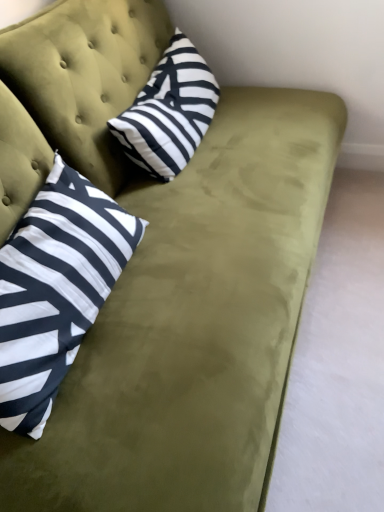
The height and width of the screenshot is (512, 384). What do you see at coordinates (169, 112) in the screenshot? I see `black and white striped pillow at upper center, the first pillow in the top-to-bottom sequence` at bounding box center [169, 112].

Locate an element on the screen. black and white striped pillow at upper center, the first pillow in the top-to-bottom sequence is located at coordinates (169, 112).

This screenshot has height=512, width=384. Identify the location of white and black striped pillow at left, which ranks as the first pillow in bottom-to-top order. (55, 289).

Describe the element at coordinates (55, 289) in the screenshot. I see `white and black striped pillow at left, which ranks as the first pillow in bottom-to-top order` at that location.

Where is `black and white striped pillow at upper center, the first pillow in the top-to-bottom sequence`? This screenshot has width=384, height=512. black and white striped pillow at upper center, the first pillow in the top-to-bottom sequence is located at coordinates (169, 112).

Considering the relative positions of white and black striped pillow at left, the 2th pillow positioned from the top, and black and white striped pillow at upper center, the second pillow in the bottom-to-top sequence, in the image provided, is white and black striped pillow at left, the 2th pillow positioned from the top, to the right of black and white striped pillow at upper center, the second pillow in the bottom-to-top sequence, from the viewer's perspective?

No.

In the image, is white and black striped pillow at left, the 2th pillow positioned from the top, positioned in front of or behind black and white striped pillow at upper center, the second pillow in the bottom-to-top sequence?

white and black striped pillow at left, the 2th pillow positioned from the top, is in front of black and white striped pillow at upper center, the second pillow in the bottom-to-top sequence.

Which is in front, point (20, 314) or point (172, 69)?

Point (20, 314)

From the image's perspective, is white and black striped pillow at left, the 2th pillow positioned from the top, on top of black and white striped pillow at upper center, the first pillow in the top-to-bottom sequence?

No, from the image's perspective, white and black striped pillow at left, the 2th pillow positioned from the top, is not over black and white striped pillow at upper center, the first pillow in the top-to-bottom sequence.

Based on the photo, from a real-world perspective, is white and black striped pillow at left, which ranks as the first pillow in bottom-to-top order, positioned above or below black and white striped pillow at upper center, the first pillow in the top-to-bottom sequence?

Clearly, from a real-world perspective, white and black striped pillow at left, which ranks as the first pillow in bottom-to-top order, is above black and white striped pillow at upper center, the first pillow in the top-to-bottom sequence.

Is white and black striped pillow at left, the 2th pillow positioned from the top, thinner than black and white striped pillow at upper center, the second pillow in the bottom-to-top sequence?

No.

Does white and black striped pillow at left, the 2th pillow positioned from the top, have a lesser height compared to black and white striped pillow at upper center, the first pillow in the top-to-bottom sequence?

No.

Considering the sizes of objects white and black striped pillow at left, the 2th pillow positioned from the top, and black and white striped pillow at upper center, the first pillow in the top-to-bottom sequence, in the image provided, who is smaller, white and black striped pillow at left, the 2th pillow positioned from the top, or black and white striped pillow at upper center, the first pillow in the top-to-bottom sequence,?

Smaller between the two is black and white striped pillow at upper center, the first pillow in the top-to-bottom sequence.

Can black and white striped pillow at upper center, the first pillow in the top-to-bottom sequence, be found inside white and black striped pillow at left, which ranks as the first pillow in bottom-to-top order?

No, black and white striped pillow at upper center, the first pillow in the top-to-bottom sequence, is not surrounded by white and black striped pillow at left, which ranks as the first pillow in bottom-to-top order.

Would you say white and black striped pillow at left, the 2th pillow positioned from the top, is a long distance from black and white striped pillow at upper center, the first pillow in the top-to-bottom sequence?

No, white and black striped pillow at left, the 2th pillow positioned from the top, is in close proximity to black and white striped pillow at upper center, the first pillow in the top-to-bottom sequence.

Is white and black striped pillow at left, which ranks as the first pillow in bottom-to-top order, turned away from black and white striped pillow at upper center, the first pillow in the top-to-bottom sequence?

white and black striped pillow at left, which ranks as the first pillow in bottom-to-top order, does not have its back to black and white striped pillow at upper center, the first pillow in the top-to-bottom sequence.

How many degrees apart are the facing directions of white and black striped pillow at left, which ranks as the first pillow in bottom-to-top order, and black and white striped pillow at upper center, the first pillow in the top-to-bottom sequence?

There is a 3.83-degree angle between the facing directions of white and black striped pillow at left, which ranks as the first pillow in bottom-to-top order, and black and white striped pillow at upper center, the first pillow in the top-to-bottom sequence.

At what (x,y) coordinates should I click in order to perform the action: click on pillow above the white and black striped pillow at left, the 2th pillow positioned from the top (from the image's perspective). Please return your answer as a coordinate pair (x, y). Looking at the image, I should click on (169, 112).

From the picture: Which is more to the right, black and white striped pillow at upper center, the first pillow in the top-to-bottom sequence, or white and black striped pillow at left, the 2th pillow positioned from the top?

Positioned to the right is black and white striped pillow at upper center, the first pillow in the top-to-bottom sequence.

Considering the positions of objects black and white striped pillow at upper center, the first pillow in the top-to-bottom sequence, and white and black striped pillow at left, the 2th pillow positioned from the top, in the image provided, who is in front, black and white striped pillow at upper center, the first pillow in the top-to-bottom sequence, or white and black striped pillow at left, the 2th pillow positioned from the top,?

white and black striped pillow at left, the 2th pillow positioned from the top, is more forward.

Which is nearer, (148, 165) or (22, 220)?

Point (148, 165) appears to be farther away from the viewer than point (22, 220).

From the image's perspective, which object appears higher, black and white striped pillow at upper center, the second pillow in the bottom-to-top sequence, or white and black striped pillow at left, the 2th pillow positioned from the top?

black and white striped pillow at upper center, the second pillow in the bottom-to-top sequence, from the image's perspective.

From a real-world perspective, who is located lower, black and white striped pillow at upper center, the first pillow in the top-to-bottom sequence, or white and black striped pillow at left, which ranks as the first pillow in bottom-to-top order?

In real-world perspective, black and white striped pillow at upper center, the first pillow in the top-to-bottom sequence, is lower.

Is black and white striped pillow at upper center, the first pillow in the top-to-bottom sequence, wider or thinner than white and black striped pillow at left, the 2th pillow positioned from the top?

Clearly, black and white striped pillow at upper center, the first pillow in the top-to-bottom sequence, has less width compared to white and black striped pillow at left, the 2th pillow positioned from the top.

Is black and white striped pillow at upper center, the first pillow in the top-to-bottom sequence, taller or shorter than white and black striped pillow at left, which ranks as the first pillow in bottom-to-top order?

Considering their sizes, black and white striped pillow at upper center, the first pillow in the top-to-bottom sequence, has less height than white and black striped pillow at left, which ranks as the first pillow in bottom-to-top order.

Does black and white striped pillow at upper center, the second pillow in the bottom-to-top sequence, have a smaller size compared to white and black striped pillow at left, the 2th pillow positioned from the top?

Indeed, black and white striped pillow at upper center, the second pillow in the bottom-to-top sequence, has a smaller size compared to white and black striped pillow at left, the 2th pillow positioned from the top.

Is black and white striped pillow at upper center, the first pillow in the top-to-bottom sequence, not inside white and black striped pillow at left, the 2th pillow positioned from the top?

Yes, black and white striped pillow at upper center, the first pillow in the top-to-bottom sequence, is not within white and black striped pillow at left, the 2th pillow positioned from the top.

Is black and white striped pillow at upper center, the second pillow in the bottom-to-top sequence, with white and black striped pillow at left, the 2th pillow positioned from the top?

No, black and white striped pillow at upper center, the second pillow in the bottom-to-top sequence, is not in contact with white and black striped pillow at left, the 2th pillow positioned from the top.

Is black and white striped pillow at upper center, the second pillow in the bottom-to-top sequence, facing away from white and black striped pillow at left, the 2th pillow positioned from the top?

No.

How many degrees apart are the facing directions of black and white striped pillow at upper center, the second pillow in the bottom-to-top sequence, and white and black striped pillow at left, the 2th pillow positioned from the top?

There is a 3.83-degree angle between the facing directions of black and white striped pillow at upper center, the second pillow in the bottom-to-top sequence, and white and black striped pillow at left, the 2th pillow positioned from the top.

How much distance is there between black and white striped pillow at upper center, the second pillow in the bottom-to-top sequence, and white and black striped pillow at left, which ranks as the first pillow in bottom-to-top order?

black and white striped pillow at upper center, the second pillow in the bottom-to-top sequence, and white and black striped pillow at left, which ranks as the first pillow in bottom-to-top order, are 18.35 inches apart.

The width and height of the screenshot is (384, 512). I want to click on pillow in front of the black and white striped pillow at upper center, the second pillow in the bottom-to-top sequence, so click(x=55, y=289).

In the image, there is a black and white striped pillow at upper center, the first pillow in the top-to-bottom sequence. Where is `pillow below it (from the image's perspective)`? pillow below it (from the image's perspective) is located at coordinates (55, 289).

This screenshot has height=512, width=384. In order to click on pillow to the right of white and black striped pillow at left, which ranks as the first pillow in bottom-to-top order in this screenshot , I will do `click(169, 112)`.